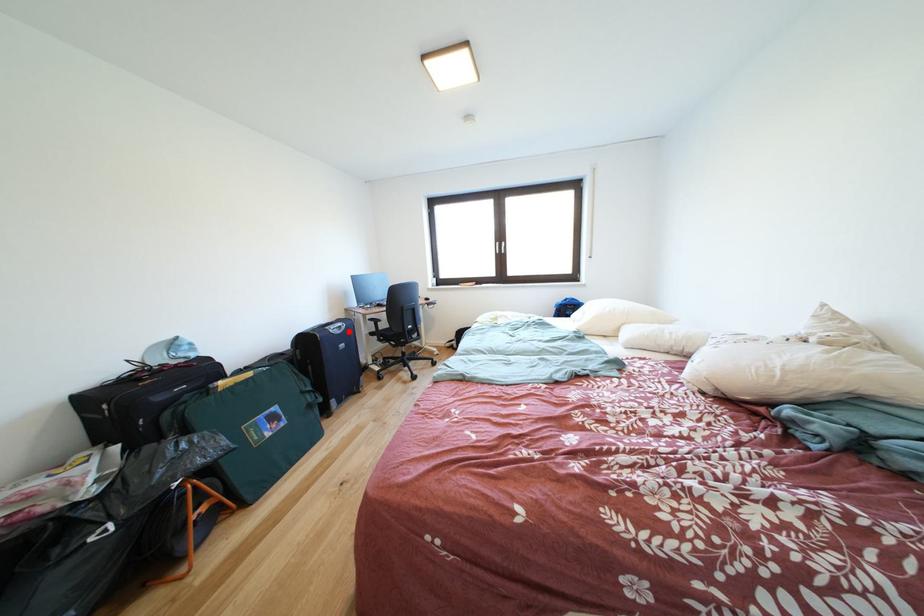
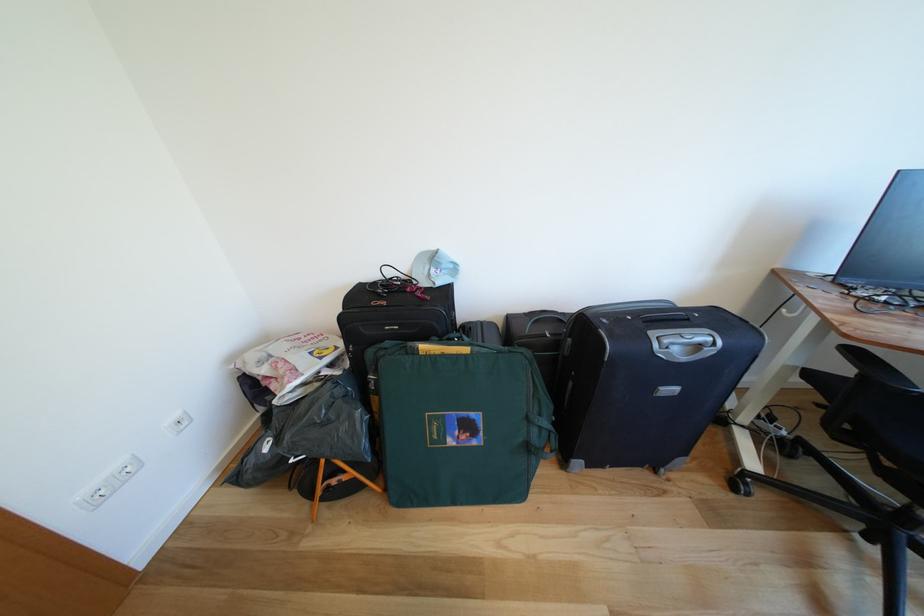
Where in the second image is the point corresponding to the highlighted location from the first image?

(707, 351)